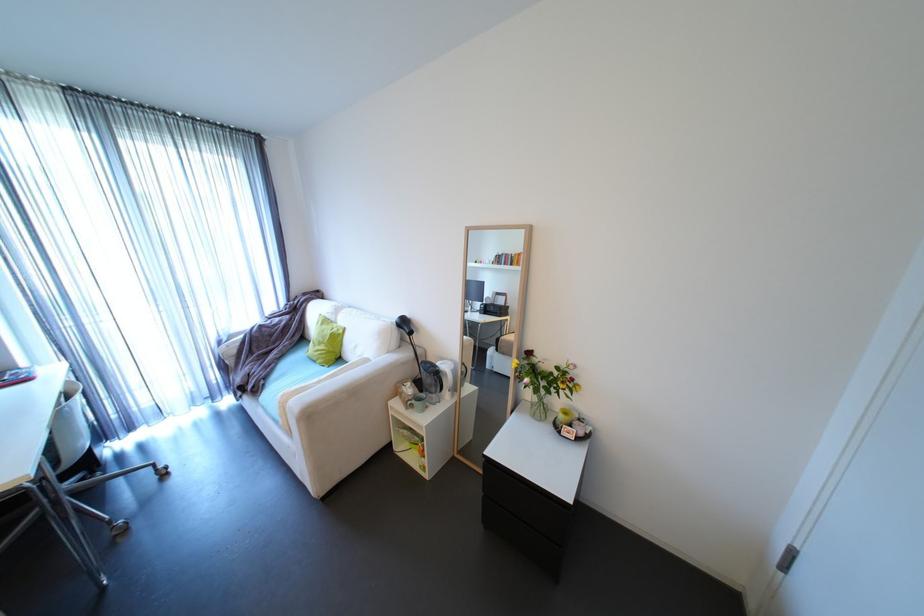
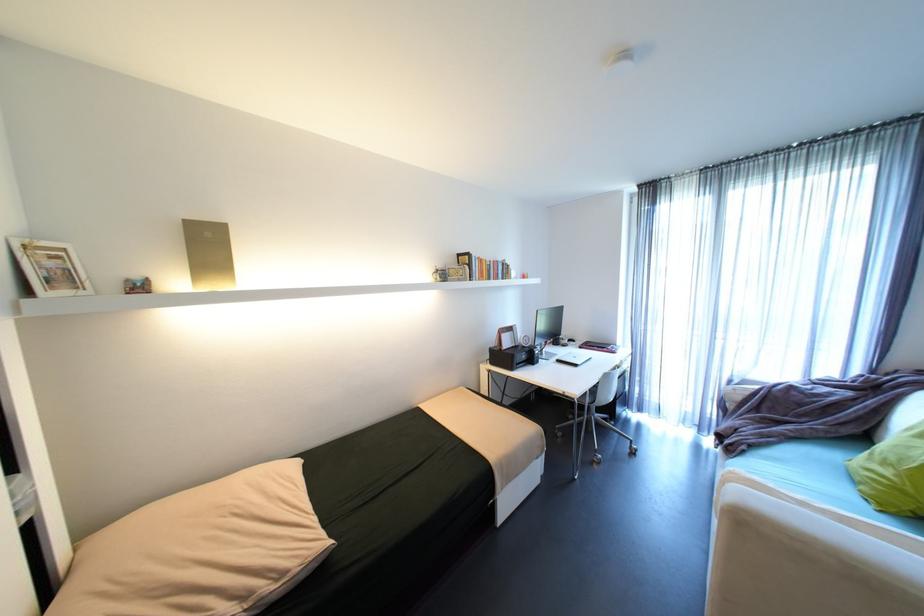
Question: The camera is either moving clockwise (left) or counter-clockwise (right) around the object. The first image is from the beginning of the video and the second image is from the end. Is the camera moving left or right when shooting the video?

Choices:
 (A) Left
 (B) Right

Answer: (B)